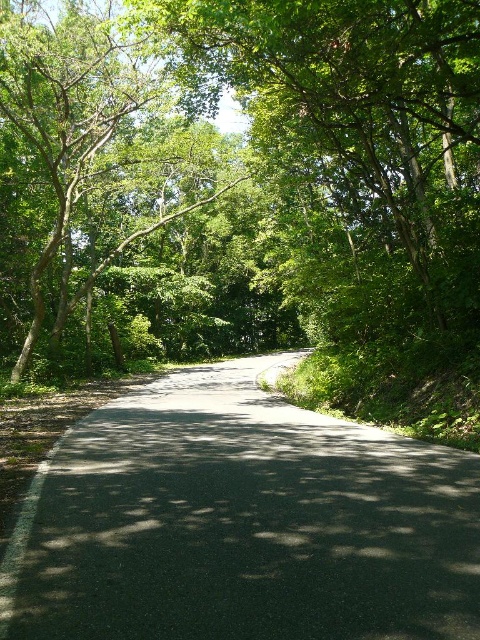
Question: Which of the following is the closest to the observer?

Choices:
 (A) (167, 625)
 (B) (56, 220)

Answer: (A)

Question: Can you confirm if black asphalt road at center is positioned above green leafy tree at upper left?

Choices:
 (A) no
 (B) yes

Answer: (A)

Question: Observing the image, what is the correct spatial positioning of black asphalt road at center in reference to green leafy tree at upper left?

Choices:
 (A) right
 (B) left

Answer: (A)

Question: Is black asphalt road at center smaller than green leafy tree at upper left?

Choices:
 (A) no
 (B) yes

Answer: (B)

Question: Which point is closer to the camera taking this photo?

Choices:
 (A) (96, 64)
 (B) (267, 428)

Answer: (B)

Question: Which point is farther to the camera?

Choices:
 (A) black asphalt road at center
 (B) green leafy tree at upper left

Answer: (B)